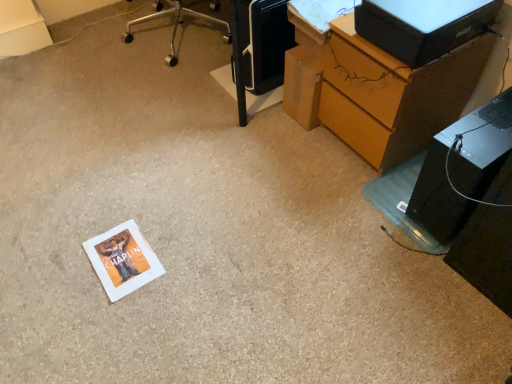
Question: Is black plastic printer at upper center positioned before wooden desk at lower right?

Choices:
 (A) yes
 (B) no

Answer: (B)

Question: Is black plastic printer at upper center located outside wooden desk at lower right?

Choices:
 (A) yes
 (B) no

Answer: (A)

Question: Does black plastic printer at upper center have a lesser height compared to wooden desk at lower right?

Choices:
 (A) yes
 (B) no

Answer: (A)

Question: Considering the relative sizes of black plastic printer at upper center and wooden desk at lower right in the image provided, is black plastic printer at upper center bigger than wooden desk at lower right?

Choices:
 (A) no
 (B) yes

Answer: (A)

Question: Is black plastic printer at upper center at the right side of wooden desk at lower right?

Choices:
 (A) no
 (B) yes

Answer: (A)

Question: Can you confirm if black plastic printer at upper center is smaller than wooden desk at lower right?

Choices:
 (A) yes
 (B) no

Answer: (A)

Question: Could you tell me if black plastic computer tower at lower right is facing wooden desk at lower right?

Choices:
 (A) yes
 (B) no

Answer: (B)

Question: Does black plastic computer tower at lower right have a greater height compared to wooden desk at lower right?

Choices:
 (A) yes
 (B) no

Answer: (B)

Question: From the image's perspective, would you say black plastic computer tower at lower right is shown under wooden desk at lower right?

Choices:
 (A) no
 (B) yes

Answer: (B)

Question: Are black plastic computer tower at lower right and wooden desk at lower right beside each other?

Choices:
 (A) yes
 (B) no

Answer: (B)

Question: Is wooden desk at lower right inside black plastic computer tower at lower right?

Choices:
 (A) no
 (B) yes

Answer: (A)

Question: Does black plastic computer tower at lower right have a smaller size compared to wooden desk at lower right?

Choices:
 (A) no
 (B) yes

Answer: (B)

Question: Can we say black plastic computer tower at lower right lies outside black plastic printer at upper center?

Choices:
 (A) no
 (B) yes

Answer: (B)